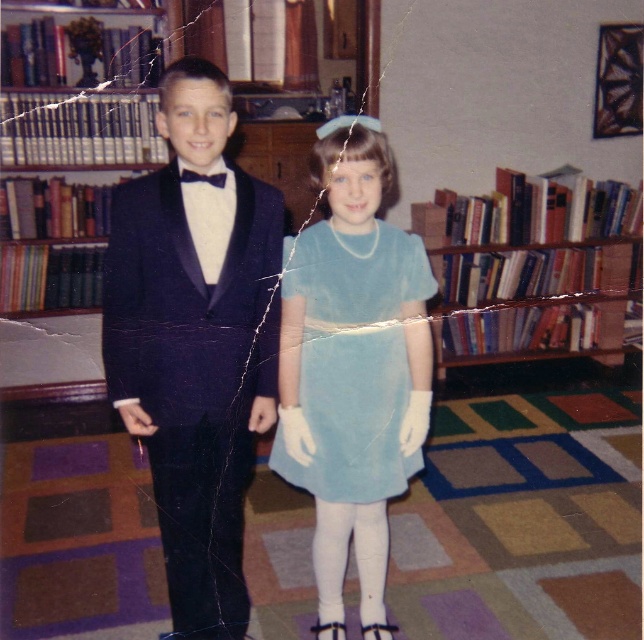
You are a photographer setting up for a formal event. You need to adjust the camera height so that both the shiny dark blue tuxedo at center and the light blue satin dress at center are fully visible in the frame. Which object should you position the camera closer to?

The shiny dark blue tuxedo at center is taller than the light blue satin dress at center. Therefore, positioning the camera closer to the shiny dark blue tuxedo at center will ensure both are fully visible in the frame.

You are a photographer setting up for a formal event. You need to position the shiny dark blue tuxedo at center and the light blue satin dress at center so that they fit within a 4x6 foot rectangular backdrop. Given their widths, which outfit requires more horizontal space?

The shiny dark blue tuxedo at center requires more horizontal space because its width is larger than the light blue satin dress at center.

You are a photographer taking a photo of the light blue satin dress at center and the black satin bow tie at upper center. Which object is closer to your camera lens?

The light blue satin dress at center is closer to the camera lens because it is further to the viewer than the black satin bow tie at upper center.